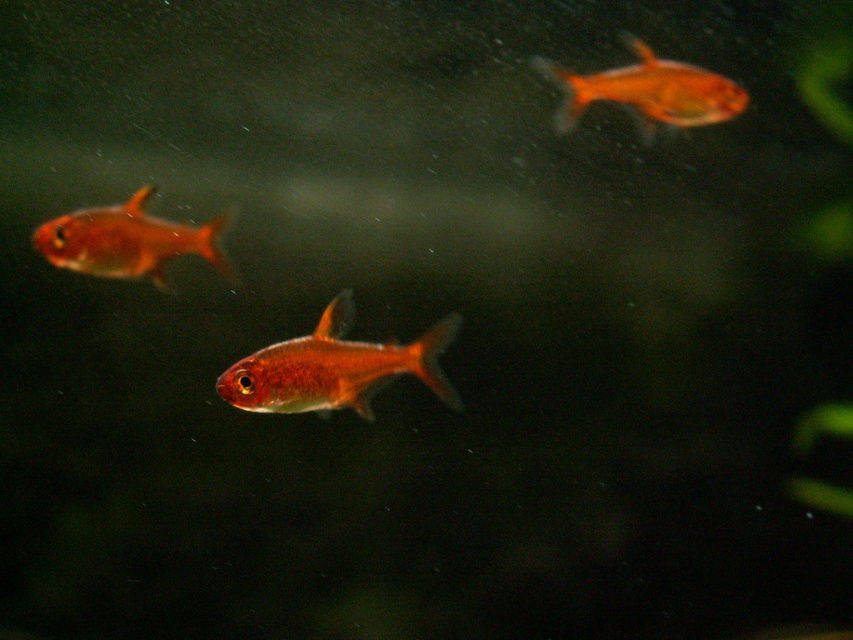
Is point (421, 362) closer to viewer compared to point (718, 104)?

That is True.

Is shiny orange fish at center to the left of glossy orange fish at upper right from the viewer's perspective?

Correct, you'll find shiny orange fish at center to the left of glossy orange fish at upper right.

Is point (323, 365) behind point (653, 124)?

No, it is not.

At what (x,y) coordinates should I click in order to perform the action: click on shiny orange fish at center. Please return your answer as a coordinate pair (x, y). This screenshot has width=853, height=640. Looking at the image, I should click on (334, 368).

Looking at this image, who is taller, shiny orange fish at left or glossy orange fish at upper right?

With more height is glossy orange fish at upper right.

Does shiny orange fish at left have a smaller size compared to glossy orange fish at upper right?

Incorrect, shiny orange fish at left is not smaller in size than glossy orange fish at upper right.

Where is `shiny orange fish at left`? shiny orange fish at left is located at coordinates (128, 241).

Locate an element on the screen. shiny orange fish at left is located at coordinates (128, 241).

Between shiny orange fish at center and shiny orange fish at left, which one has more height?

Standing taller between the two is shiny orange fish at center.

Does shiny orange fish at center have a larger size compared to shiny orange fish at left?

Indeed, shiny orange fish at center has a larger size compared to shiny orange fish at left.

Find the location of a particular element. This screenshot has height=640, width=853. shiny orange fish at center is located at coordinates (334, 368).